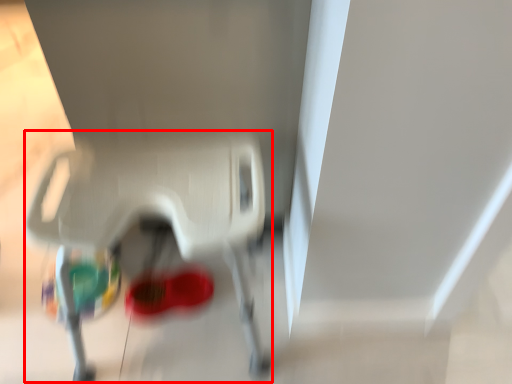
Question: From the image's perspective, what is the correct spatial positioning of baby carriage (annotated by the red box) in reference to footwear?

Choices:
 (A) above
 (B) below

Answer: (A)